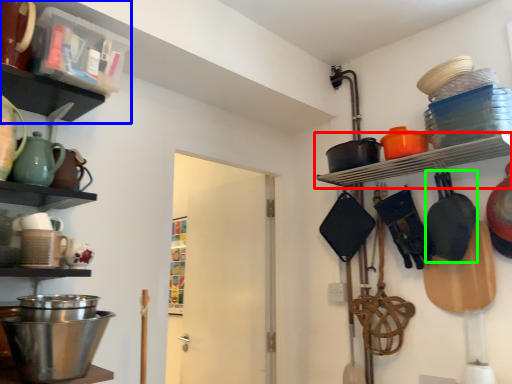
Question: Estimate the real-world distances between objects in this image. Which object is closer to shelf (highlighted by a red box), shelf (highlighted by a blue box) or frying pan (highlighted by a green box)?

Choices:
 (A) shelf
 (B) frying pan

Answer: (B)